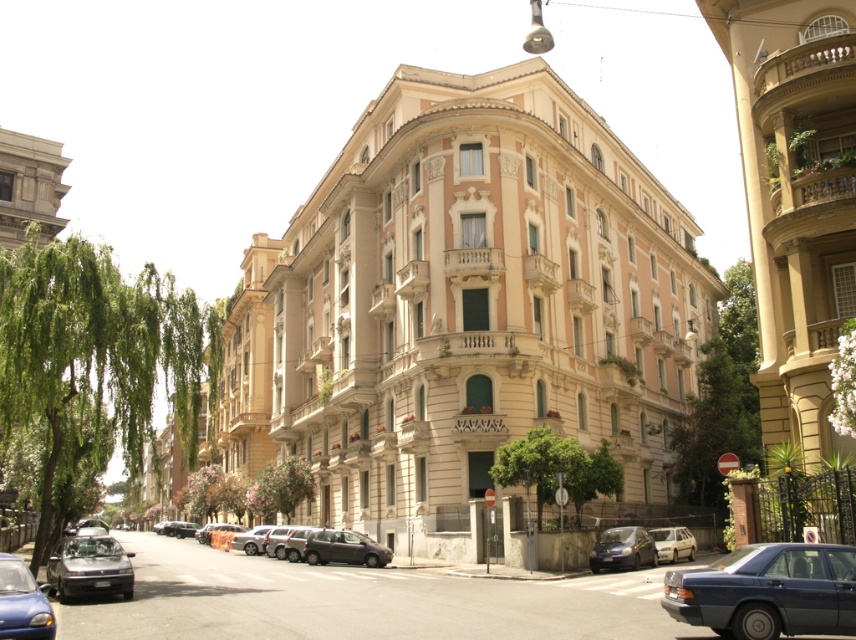
You are a pedestrian standing at the pedestrian crossing in front of the ornate building. You need to cross the street to the other side. Are the metallic blue sedan at lower right and the matte blue car at lower left both blocking your path?

The matte blue car at lower left is behind the metallic blue sedan at lower right, so only the metallic blue sedan at lower right is blocking your path. The matte blue car at lower left is not in front of you since it is behind the metallic blue sedan at lower right.

You are a delivery person needing to park your vehicle in the street. You have two options in the image, the metallic blue sedan at lower right and the matte blue car at lower left. Which car takes up less space on the street?

The metallic blue sedan at lower right is smaller than the matte blue car at lower left, so it takes up less space on the street.

You are a delivery person trying to park your 1.8 meters wide van between the metallic blue sedan at lower right and the shiny black car at lower left. Can your van fit in the space between them?

The metallic blue sedan at lower right is narrower than the shiny black car at lower left, so the space between them may be sufficient. However, since the exact width of the space isn